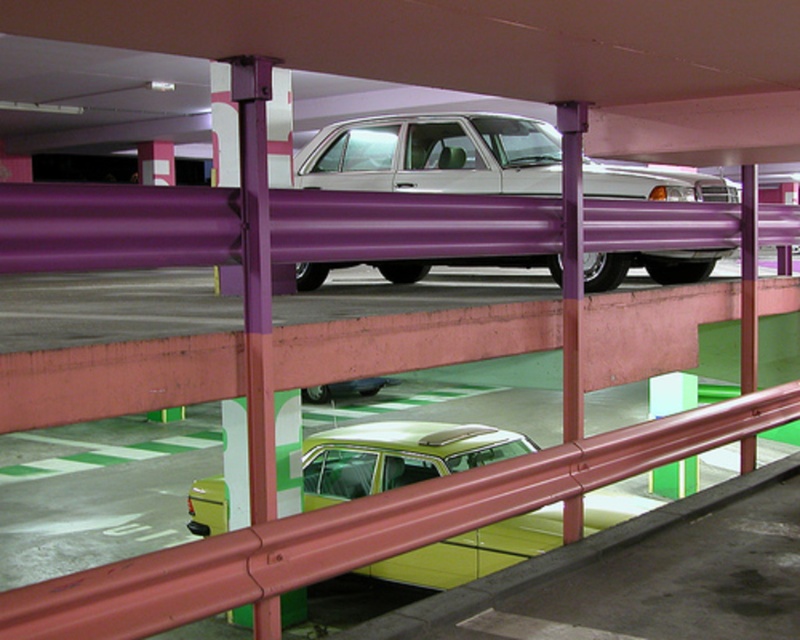
Who is lower down, silver metallic sedan at center or green matte car at center?

green matte car at center is below.

Is silver metallic sedan at center smaller than green matte car at center?

Incorrect, silver metallic sedan at center is not smaller in size than green matte car at center.

At what (x,y) coordinates should I click in order to perform the action: click on silver metallic sedan at center. Please return your answer as a coordinate pair (x, y). Looking at the image, I should click on (434, 154).

At what (x,y) coordinates should I click in order to perform the action: click on silver metallic sedan at center. Please return your answer as a coordinate pair (x, y). This screenshot has width=800, height=640. Looking at the image, I should click on (434, 154).

Is silver metallic sedan at center wider than metallic silver sedan at lower center?

Indeed, silver metallic sedan at center has a greater width compared to metallic silver sedan at lower center.

Does silver metallic sedan at center appear over metallic silver sedan at lower center?

Yes, silver metallic sedan at center is above metallic silver sedan at lower center.

What do you see at coordinates (434, 154) in the screenshot? I see `silver metallic sedan at center` at bounding box center [434, 154].

What are the coordinates of `silver metallic sedan at center` in the screenshot? It's located at (434, 154).

Consider the image. Which is more to the right, green matte car at center or metallic silver sedan at lower center?

green matte car at center

Which is behind, point (376, 429) or point (388, 381)?

Point (388, 381)

Image resolution: width=800 pixels, height=640 pixels. Find the location of `green matte car at center`. green matte car at center is located at coordinates point(397,456).